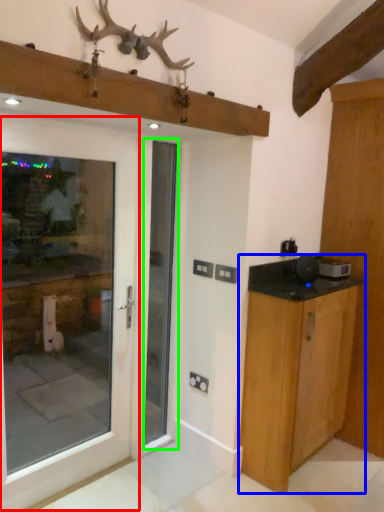
Question: Which is nearer to the door (highlighted by a red box)? cabinetry (highlighted by a blue box) or screen door (highlighted by a green box).

Choices:
 (A) cabinetry
 (B) screen door

Answer: (B)